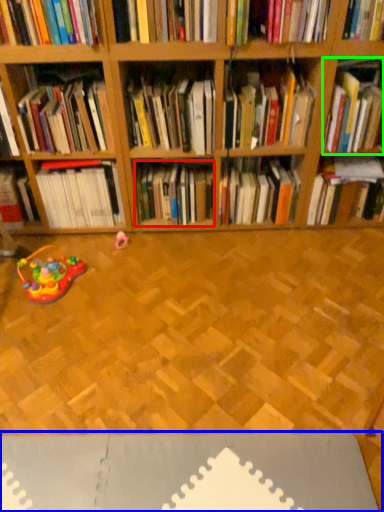
Question: Which object is positioned farthest from book (highlighted by a red box)? Select from surface (highlighted by a blue box) and book (highlighted by a green box).

Choices:
 (A) surface
 (B) book

Answer: (A)